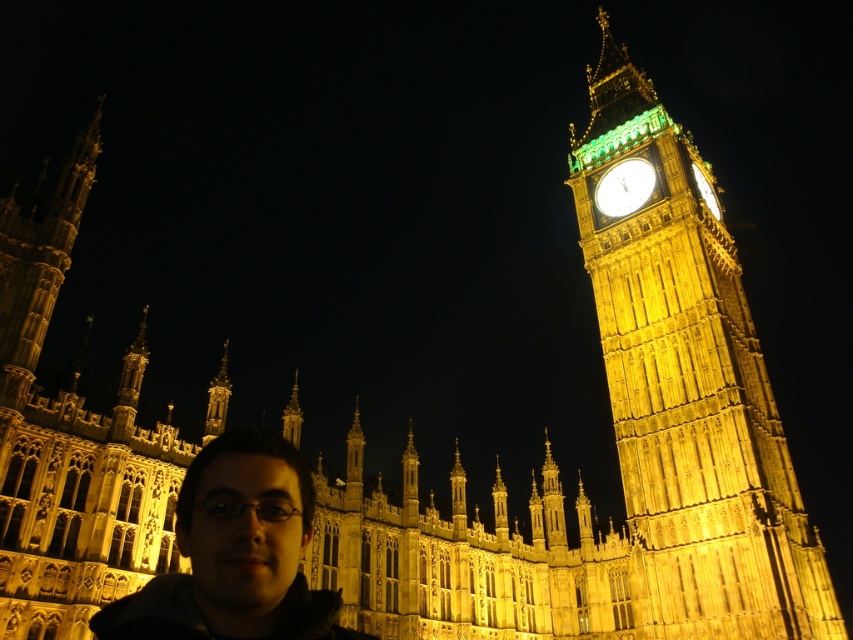
Is golden stone clock tower at right to the right of gold metallic clock at upper right from the viewer's perspective?

Yes, golden stone clock tower at right is to the right of gold metallic clock at upper right.

Between golden stone clock tower at right and gold metallic clock at upper right, which one appears on the left side from the viewer's perspective?

From the viewer's perspective, gold metallic clock at upper right appears more on the left side.

Is point (815, 625) behind point (596, 186)?

No, it is not.

Identify the location of golden stone clock tower at right. Image resolution: width=853 pixels, height=640 pixels. (689, 387).

Which of these two, golden stone clock tower at right or matte black jacket at lower left, stands shorter?

matte black jacket at lower left is shorter.

Does point (664, 481) come in front of point (149, 634)?

That is False.

Is point (653, 502) more distant than point (294, 545)?

Yes, it is.

This screenshot has width=853, height=640. What are the coordinates of `golden stone clock tower at right` in the screenshot? It's located at (689, 387).

Between matte black jacket at lower left and gold metallic clock at upper right, which one is positioned higher?

gold metallic clock at upper right

Is point (238, 557) positioned after point (631, 157)?

No, (238, 557) is in front of (631, 157).

Is point (210, 621) in front of point (608, 189)?

Yes.

At what (x,y) coordinates should I click in order to perform the action: click on matte black jacket at lower left. Please return your answer as a coordinate pair (x, y). Looking at the image, I should click on (235, 552).